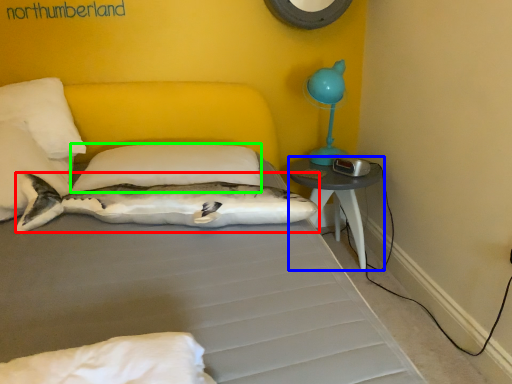
Question: Based on their relative distances, which object is nearer to shark (highlighted by a red box)? Choose from nightstand (highlighted by a blue box) and pillow (highlighted by a green box).

Choices:
 (A) nightstand
 (B) pillow

Answer: (B)